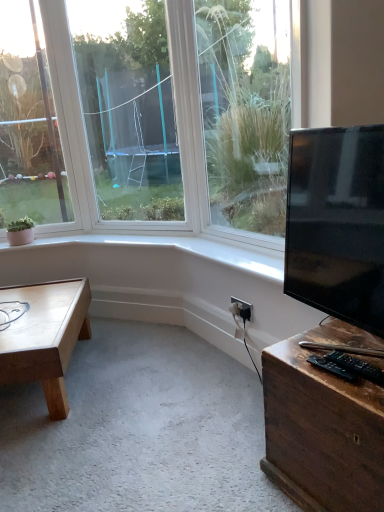
Locate an element on the screen. free space above light brown wooden coffee table at lower left (from a real-world perspective) is located at coordinates (29, 307).